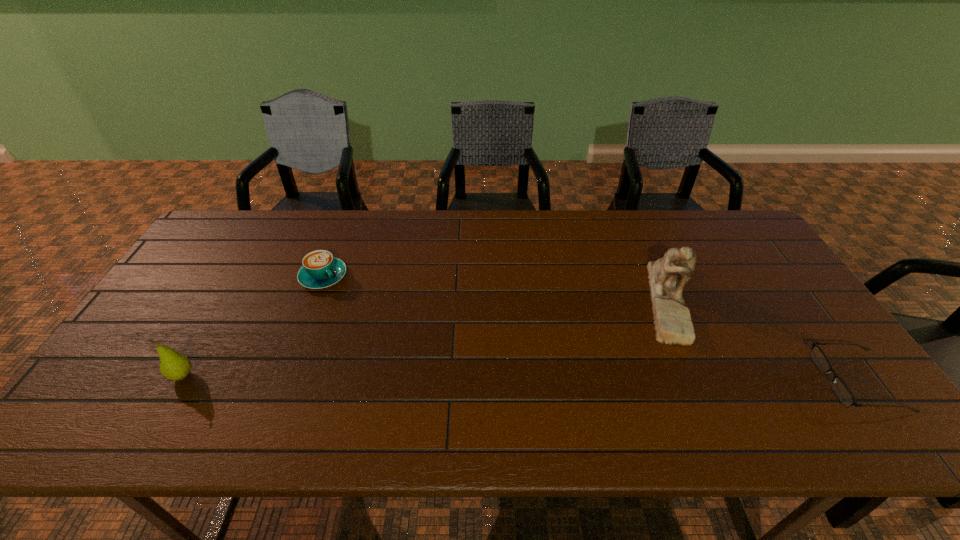
Locate an element on the screen. vacant space on the desktop that is between the leftmost object and the shortest object and is positioned on the front-facing side of the second object from right to left is located at coordinates (544, 379).

Locate an element on the screen. free space on the desktop that is between the leftmost object and the spectacles and is positioned with the handle on the right side of the second shortest object is located at coordinates (426, 377).